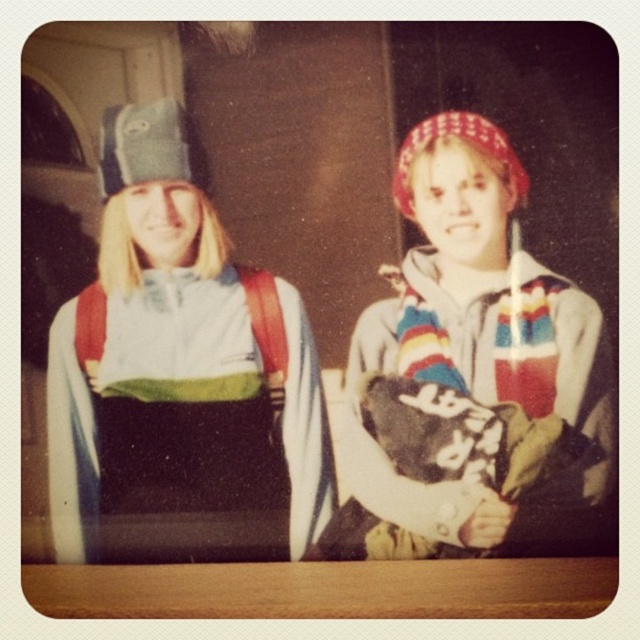
You are a photographer setting up a shoot with two models. The scene includes a matte blue ski jacket at left. You need to ensure that this jacket is in sharp focus while keeping the other model in the background slightly blurred. Given the distance between the jacket and the camera, what is the minimum focal length you should use if your camera has an aperture of f2.8 and a hyperfocal distance of 2 meters?

The matte blue ski jacket at left is 83.93 centimeters away from the camera. To keep it in focus at this distance with an aperture of f2.8 and hyperfocal distance of 2 meters, the minimum focal length required would be calculated using the formula for depth of field. However, since the hyperfocal distance is 2 meters, which is greater than the jacket distance, the entire scene would already be in focus. Therefore, adjusting the focal length may not be necessary, but using a focal length between 50mm to 85mm

You are organizing a clothing photoshoot and need to ensure proper visibility of all garments. Given the positioning of the matte multicolored hoodie at center and the matte white and green jacket at center, which garment is more likely to be fully visible in the image?

The matte multicolored hoodie at center is more likely to be fully visible because it is in front of the matte white and green jacket at center, making the latter partially obscured.